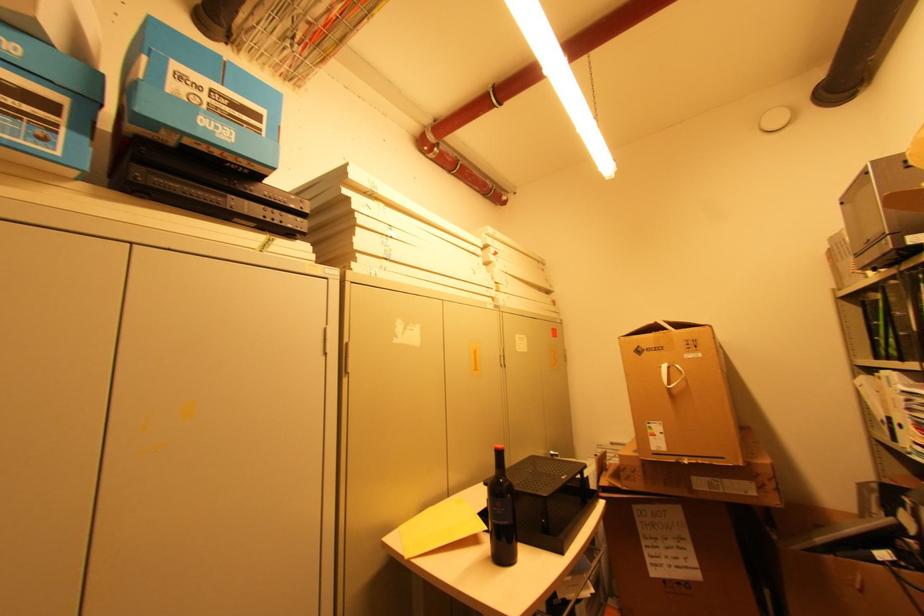
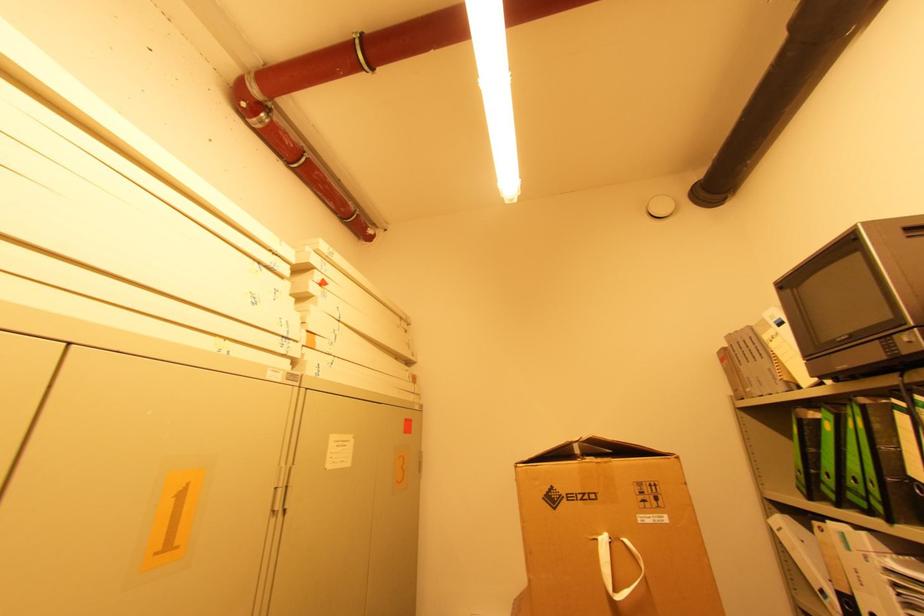
Where in the second image is the point corresponding to (x=504, y=357) from the first image?

(280, 488)